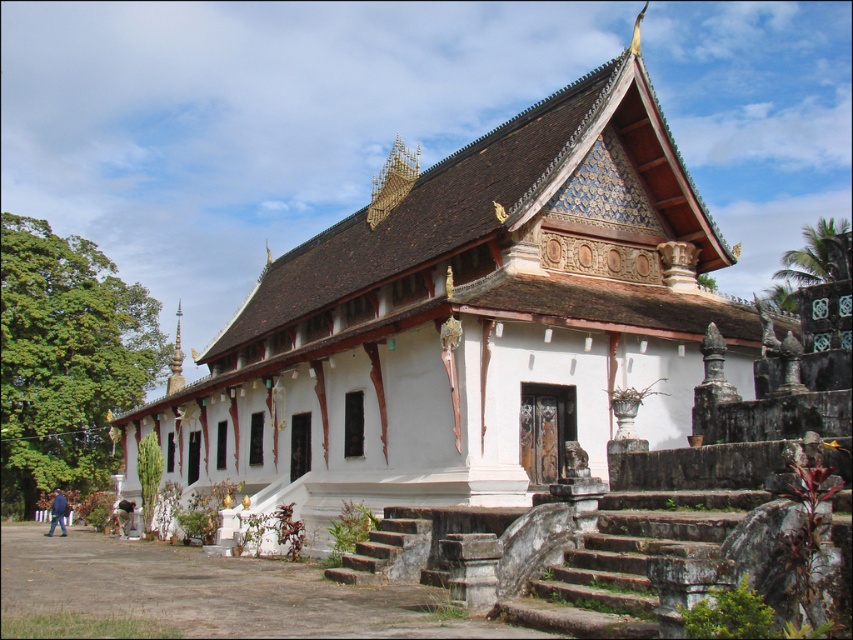
Question: Which object is farther from the camera taking this photo?

Choices:
 (A) white painted wood palace at center
 (B) gold/gilded stupa at left

Answer: (B)

Question: Which point is closer to the camera?

Choices:
 (A) (178, 378)
 (B) (672, 257)

Answer: (B)

Question: Is white painted wood palace at center behind gold/gilded stupa at left?

Choices:
 (A) no
 (B) yes

Answer: (A)

Question: Can you confirm if white painted wood palace at center is wider than gold/gilded stupa at left?

Choices:
 (A) yes
 (B) no

Answer: (A)

Question: Is white painted wood palace at center to the left of gold/gilded stupa at left from the viewer's perspective?

Choices:
 (A) no
 (B) yes

Answer: (A)